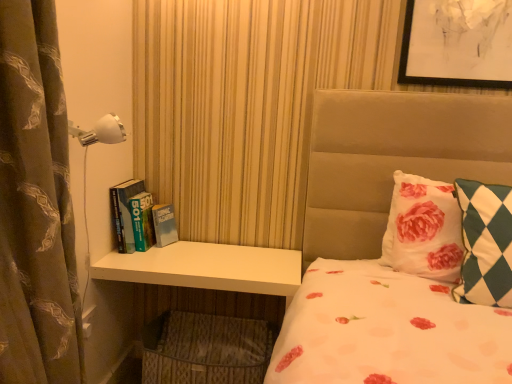
Question: Is white plastic lamp at upper left positioned beyond the bounds of white matte dresser at lower left?

Choices:
 (A) no
 (B) yes

Answer: (B)

Question: From a real-world perspective, does white plastic lamp at upper left stand above white matte dresser at lower left?

Choices:
 (A) no
 (B) yes

Answer: (B)

Question: Is white plastic lamp at upper left bigger than white matte dresser at lower left?

Choices:
 (A) no
 (B) yes

Answer: (A)

Question: From a real-world perspective, is white plastic lamp at upper left physically below white matte dresser at lower left?

Choices:
 (A) yes
 (B) no

Answer: (B)

Question: Considering the relative positions of white plastic lamp at upper left and white matte dresser at lower left in the image provided, is white plastic lamp at upper left in front of white matte dresser at lower left?

Choices:
 (A) yes
 (B) no

Answer: (A)

Question: Is green checkered pillow at right, marked as the second pillow in a back-to-front arrangement, taller or shorter than brown printed fabric curtain at left?

Choices:
 (A) short
 (B) tall

Answer: (A)

Question: Looking at their shapes, would you say green checkered pillow at right, the first pillow in the front-to-back sequence, is wider or thinner than brown printed fabric curtain at left?

Choices:
 (A) thin
 (B) wide

Answer: (A)

Question: Is green checkered pillow at right, marked as the second pillow in a back-to-front arrangement, inside or outside of brown printed fabric curtain at left?

Choices:
 (A) outside
 (B) inside

Answer: (A)

Question: From the image's perspective, is green checkered pillow at right, the first pillow in the front-to-back sequence, above or below brown printed fabric curtain at left?

Choices:
 (A) below
 (B) above

Answer: (A)

Question: Considering their positions, is white floral pillow at upper right, acting as the 2th pillow starting from the front, located in front of or behind brown printed fabric curtain at left?

Choices:
 (A) front
 (B) behind

Answer: (B)

Question: From the image's perspective, is white floral pillow at upper right, acting as the 2th pillow starting from the front, located above or below brown printed fabric curtain at left?

Choices:
 (A) above
 (B) below

Answer: (B)

Question: Visually, is white floral pillow at upper right, acting as the 2th pillow starting from the front, positioned to the left or to the right of brown printed fabric curtain at left?

Choices:
 (A) left
 (B) right

Answer: (B)

Question: Is white floral pillow at upper right, acting as the 2th pillow starting from the front, taller or shorter than brown printed fabric curtain at left?

Choices:
 (A) short
 (B) tall

Answer: (A)

Question: Considering the positions of point (482, 208) and point (175, 243), is point (482, 208) closer or farther from the camera than point (175, 243)?

Choices:
 (A) closer
 (B) farther

Answer: (A)

Question: Considering the positions of green checkered pillow at right, the first pillow in the front-to-back sequence, and white matte dresser at lower left in the image, is green checkered pillow at right, the first pillow in the front-to-back sequence, wider or thinner than white matte dresser at lower left?

Choices:
 (A) thin
 (B) wide

Answer: (A)